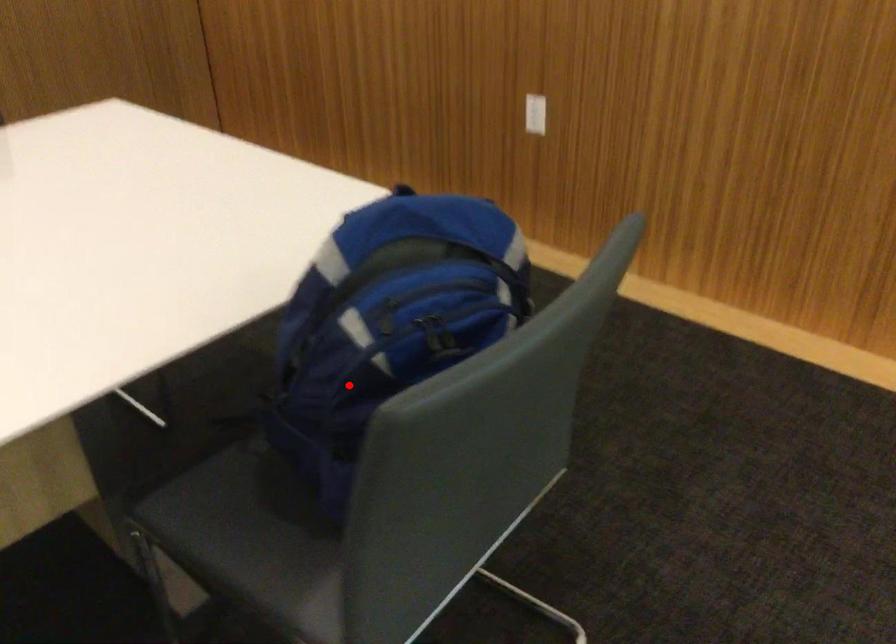
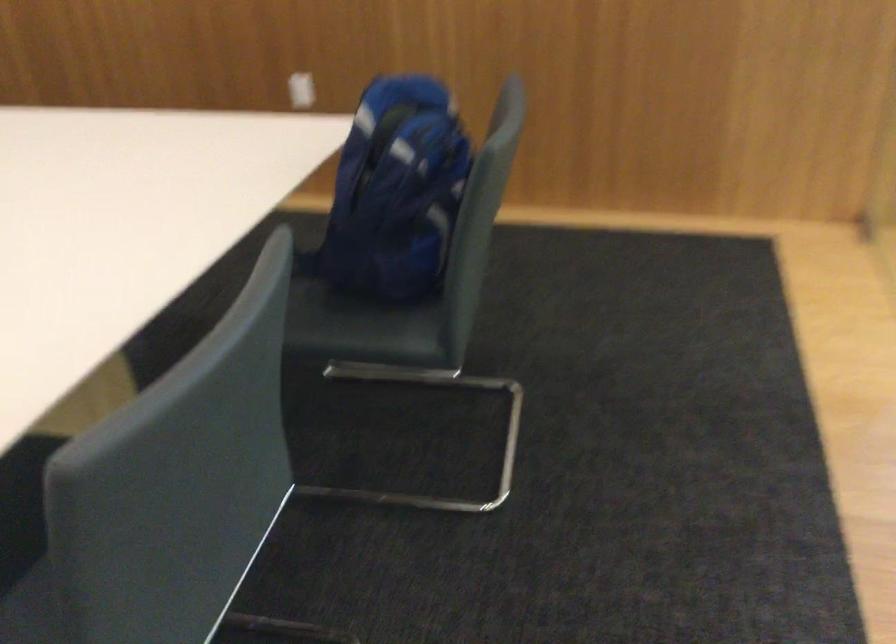
The point at the highlighted location is marked in the first image. Where is the corresponding point in the second image?

(395, 192)